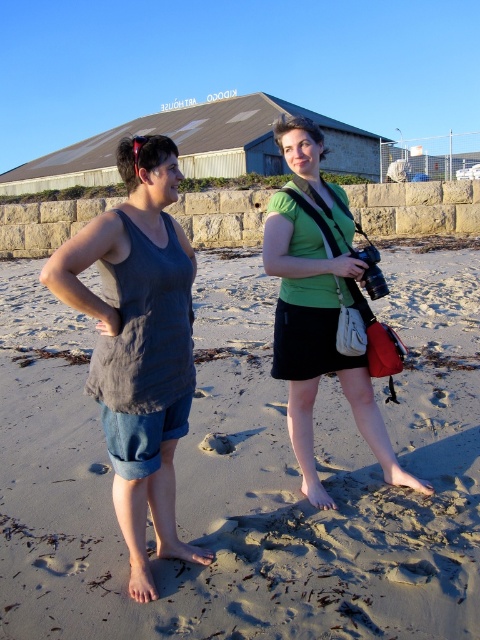
Is sandy beach at center taller than green matte shirt at center?

No.

Between sandy beach at center and green matte shirt at center, which one has more height?

With more height is green matte shirt at center.

Between point (452, 529) and point (300, 196), which one is positioned in front?

Point (452, 529) is in front.

You are a GUI agent. You are given a task and a screenshot of the screen. Output one action in this format:
    pyautogui.click(x=<x>, y=<y>)
    Task: Click on the sandy beach at center
    The height and width of the screenshot is (640, 480).
    Given the screenshot: What is the action you would take?
    pyautogui.click(x=249, y=476)

Which is below, denim shorts at left or green matte shirt at center?

denim shorts at left

Does denim shorts at left appear on the right side of green matte shirt at center?

In fact, denim shorts at left is to the left of green matte shirt at center.

Between point (133, 339) and point (321, 262), which one is positioned in front?

Point (133, 339) is in front.

Where is `denim shorts at left`? This screenshot has width=480, height=640. denim shorts at left is located at coordinates (139, 344).

Between point (266, 548) and point (160, 212), which one is positioned in front?

Point (160, 212) is in front.

In the scene shown: Who is higher up, sandy beach at center or denim shorts at left?

denim shorts at left

Where is `sandy beach at center`? The width and height of the screenshot is (480, 640). sandy beach at center is located at coordinates (249, 476).